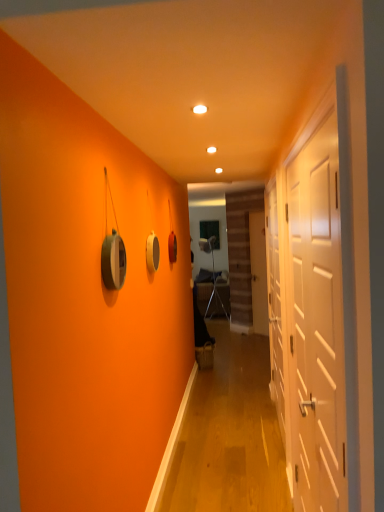
Question: Is white matte door at center, which is the 3th door from front to back, bigger than white glossy door at right, placed as the 1th door when sorted from left to right?

Choices:
 (A) no
 (B) yes

Answer: (B)

Question: From the image's perspective, is white matte door at center, which appears as the first door when viewed from the right, on white glossy door at right, the third door from the back?

Choices:
 (A) no
 (B) yes

Answer: (B)

Question: Is white matte door at center, which appears as the first door when viewed from the right, wider than white glossy door at right, which ranks as the 3th door in right-to-left order?

Choices:
 (A) no
 (B) yes

Answer: (B)

Question: Can you confirm if white matte door at center, placed as the third door when sorted from left to right, is smaller than white glossy door at right, which ranks as the 3th door in right-to-left order?

Choices:
 (A) yes
 (B) no

Answer: (B)

Question: Can you confirm if white matte door at center, which appears as the first door when viewed from the right, is shorter than white glossy door at right, marked as the 1th door in a front-to-back arrangement?

Choices:
 (A) yes
 (B) no

Answer: (B)

Question: Are white matte door at center, which is the 3th door from front to back, and white glossy door at right, placed as the 1th door when sorted from left to right, making contact?

Choices:
 (A) yes
 (B) no

Answer: (B)

Question: From the image's perspective, is white glossy door at right, which ranks as the 3th door in right-to-left order, over metallic silver armchair at center?

Choices:
 (A) yes
 (B) no

Answer: (A)

Question: Is white glossy door at right, the third door from the back, smaller than metallic silver armchair at center?

Choices:
 (A) yes
 (B) no

Answer: (A)

Question: From a real-world perspective, is white glossy door at right, marked as the 1th door in a front-to-back arrangement, under metallic silver armchair at center?

Choices:
 (A) no
 (B) yes

Answer: (A)

Question: Is white glossy door at right, which ranks as the 3th door in right-to-left order, to the left of metallic silver armchair at center from the viewer's perspective?

Choices:
 (A) yes
 (B) no

Answer: (A)

Question: Is white glossy door at right, placed as the 1th door when sorted from left to right, facing away from metallic silver armchair at center?

Choices:
 (A) yes
 (B) no

Answer: (B)

Question: Can you confirm if white glossy door at right, marked as the 1th door in a front-to-back arrangement, is positioned to the right of metallic silver armchair at center?

Choices:
 (A) yes
 (B) no

Answer: (B)

Question: Is white matte door at right, the second door viewed from the left, oriented away from metallic silver armchair at center?

Choices:
 (A) no
 (B) yes

Answer: (A)